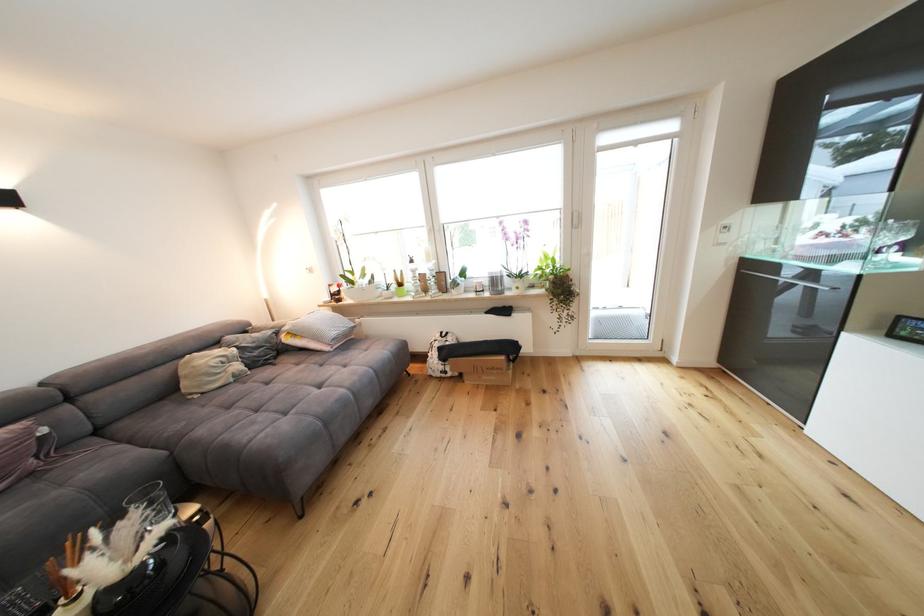
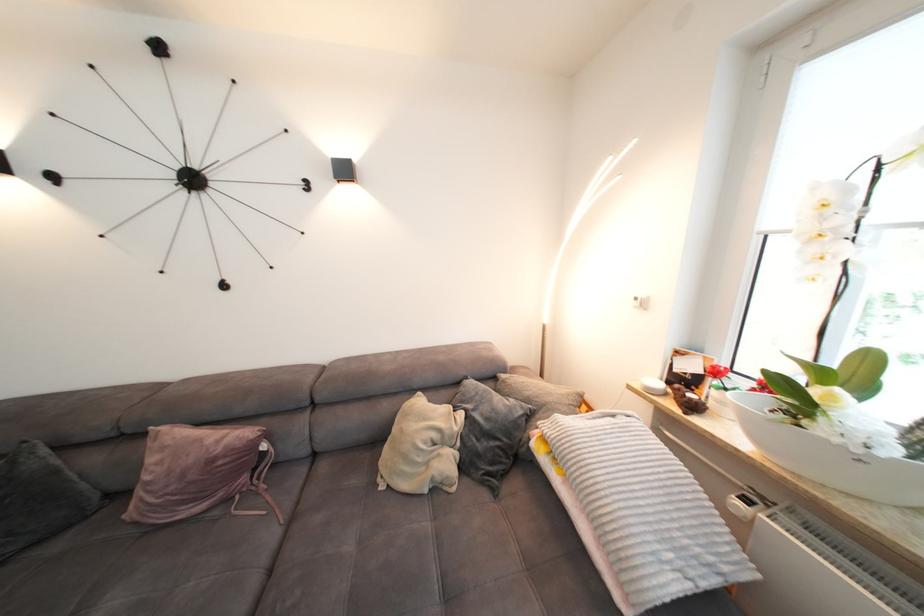
In the second image, find the point that corresponds to [333,304] in the first image.

(657, 391)